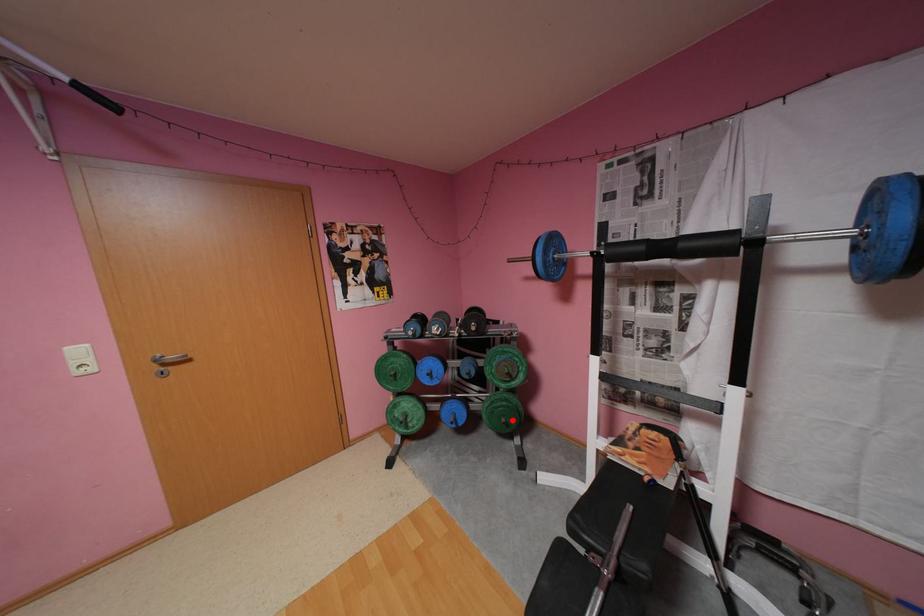
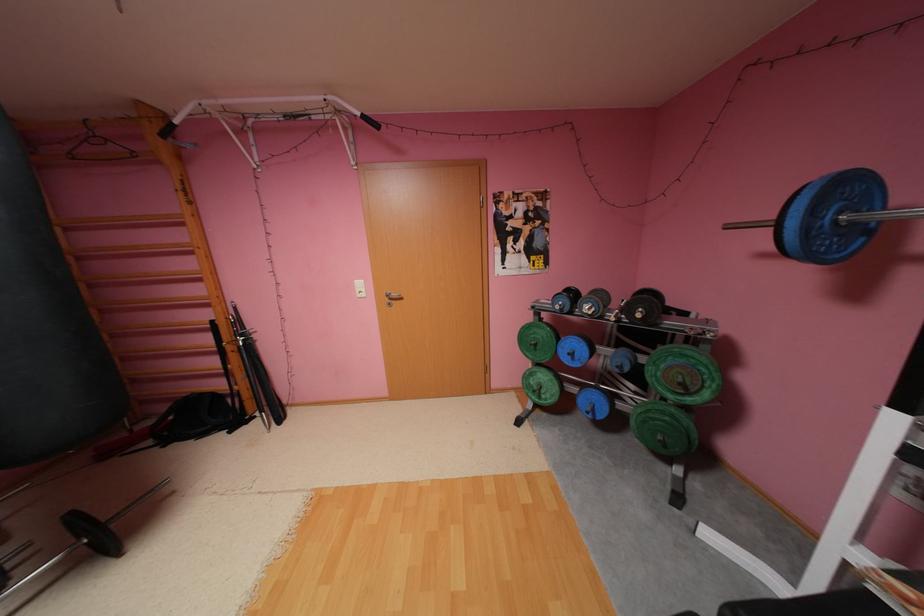
The point at the highlighted location is marked in the first image. Where is the corresponding point in the second image?

(669, 438)